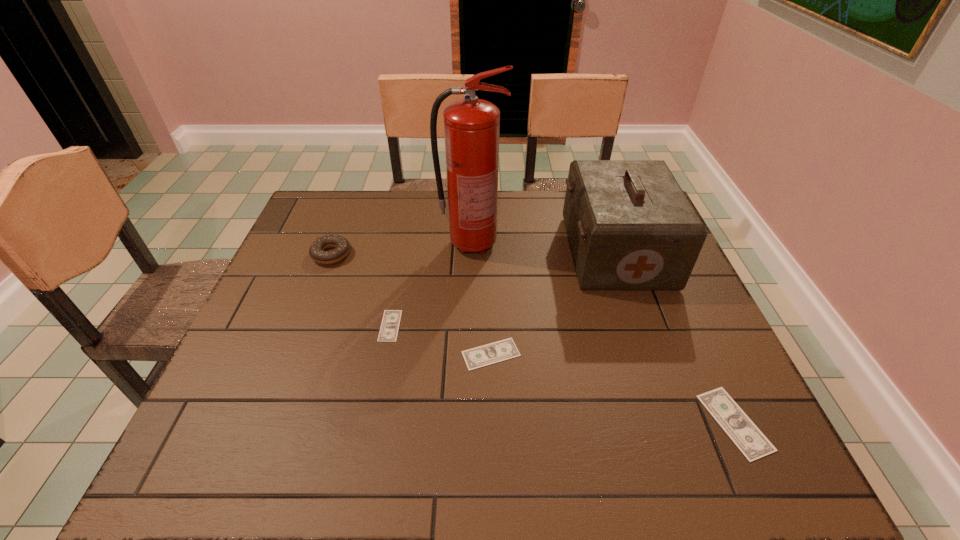
If we want them evenly spaced by inserting an extra money among them, please locate a free spot for this new money. Please provide its 2D coordinates. Your answer should be formatted as a tuple, i.e. [(x, y)], where the tuple contains the x and y coordinates of a point satisfying the conditions above.

[(605, 386)]